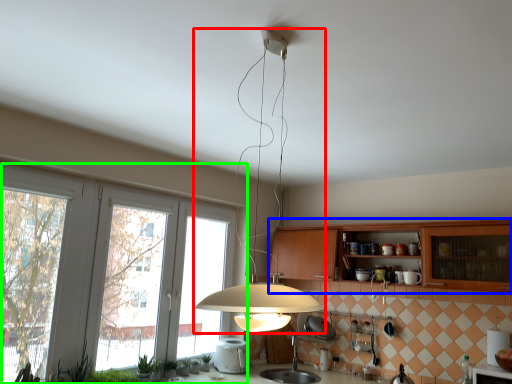
Question: Which object is the farthest from lamp (highlighted by a red box)? Choose among these: cabinetry (highlighted by a blue box) or window (highlighted by a green box).

Choices:
 (A) cabinetry
 (B) window

Answer: (B)